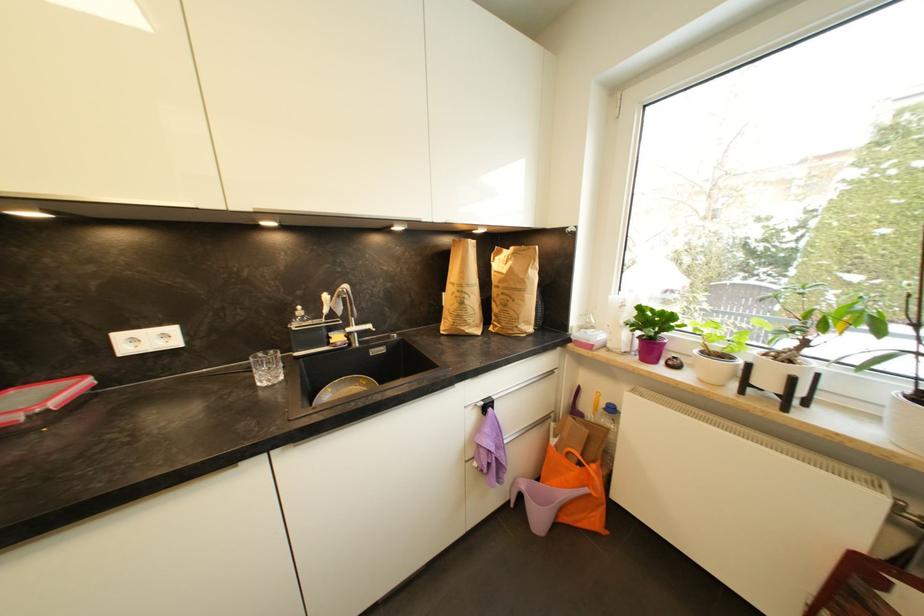
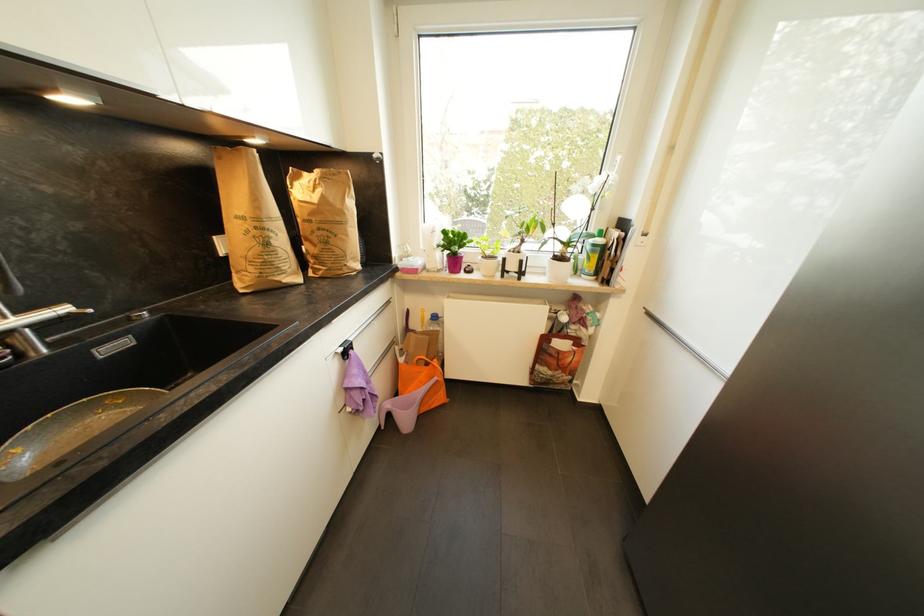
Where in the second image is the point corresponding to (x=527, y=485) from the first image?

(393, 407)